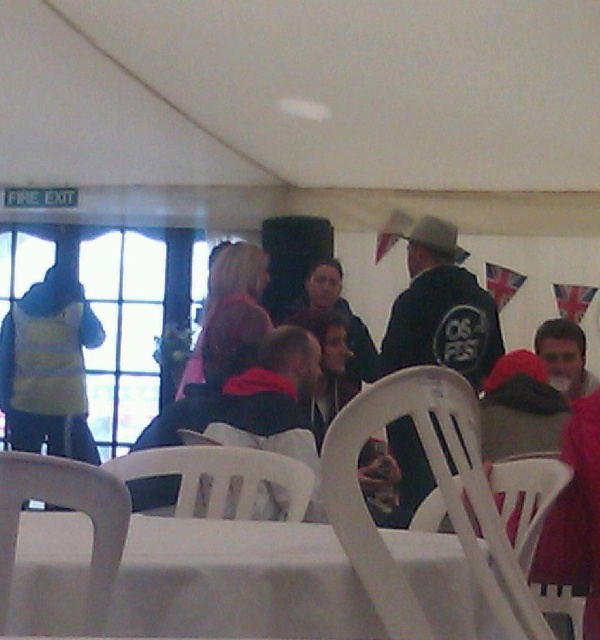
Question: Which point appears farthest from the camera in this image?

Choices:
 (A) (168, 541)
 (B) (402, 401)

Answer: (A)

Question: Estimate the real-world distances between objects in this image. Which object is farther from the white plastic chair at center?

Choices:
 (A) white plastic chair at lower center
 (B) smooth gray shirt at center

Answer: (B)

Question: Does white plastic chair at lower center have a smaller size compared to matte pink sweater at center?

Choices:
 (A) no
 (B) yes

Answer: (B)

Question: Does white plastic table at lower center appear over black matte jacket at center?

Choices:
 (A) yes
 (B) no

Answer: (B)

Question: Which object appears closest to the camera in this image?

Choices:
 (A) white plastic table at lower center
 (B) white plastic chair at lower center
 (C) black matte jacket at center

Answer: (A)

Question: Is white plastic table at lower center bigger than white plastic chair at center?

Choices:
 (A) no
 (B) yes

Answer: (A)